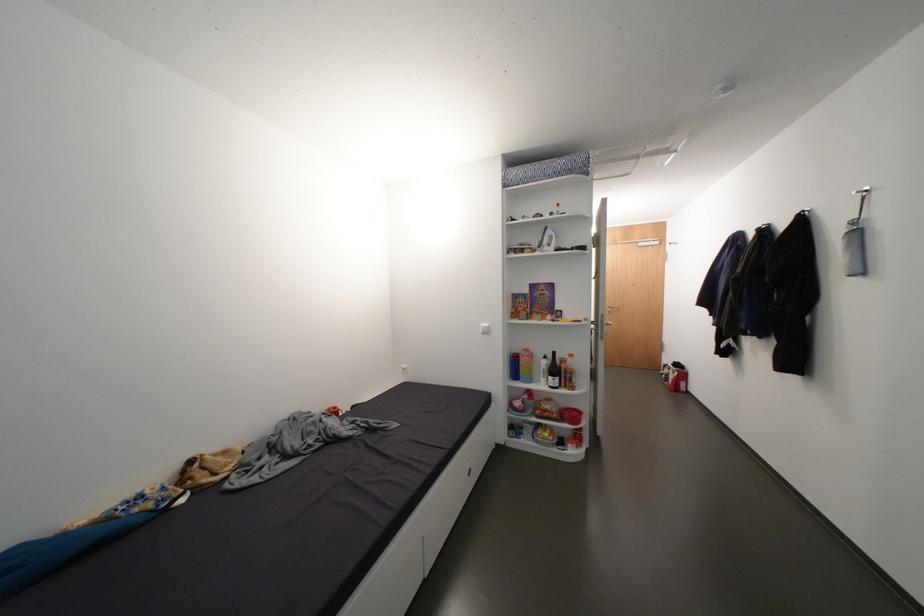
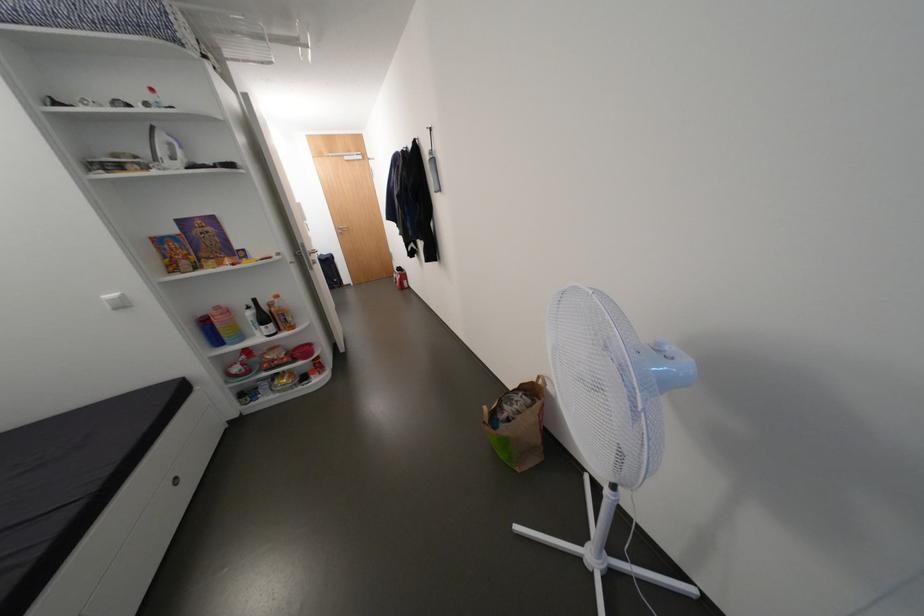
Where in the second image is the point corresponding to pixel 679 365 from the first image?

(405, 270)